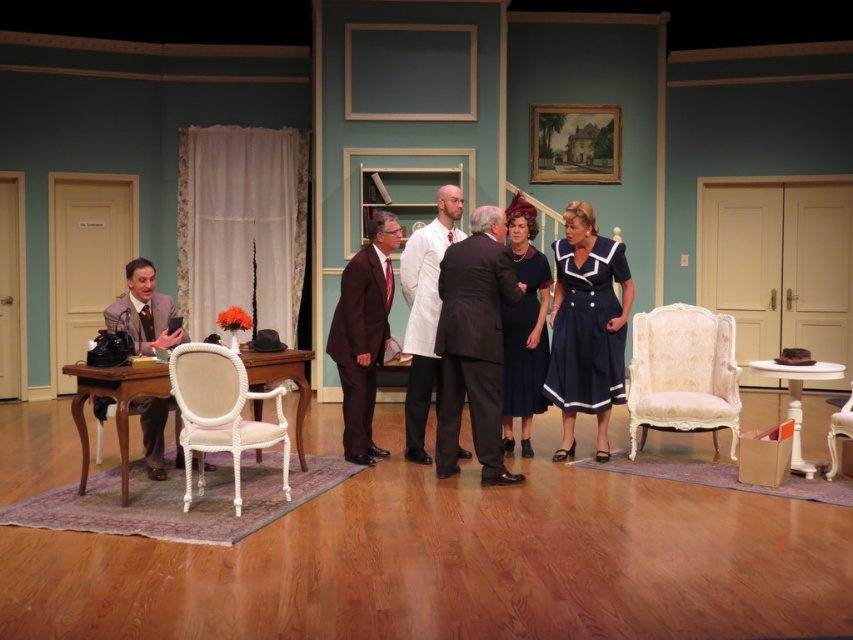
Question: Which point is farther from the camera taking this photo?

Choices:
 (A) (451, 417)
 (B) (410, 300)
 (C) (368, 250)
 (D) (834, 454)

Answer: (B)

Question: Does navy blue fabric dress at center have a smaller size compared to velvet navy dress at center?

Choices:
 (A) yes
 (B) no

Answer: (B)

Question: In this image, where is white rope chair at center located relative to shiny brown suit at center?

Choices:
 (A) left
 (B) right

Answer: (A)

Question: Which of the following is the farthest from the observer?

Choices:
 (A) white upholstered chair at right
 (B) white rope chair at center

Answer: (A)

Question: Is velvet cream chair at right in front of white matte coat at center?

Choices:
 (A) yes
 (B) no

Answer: (A)

Question: Which of these objects is positioned closest to the dark gray suit at center?

Choices:
 (A) white upholstered chair at right
 (B) navy blue fabric dress at center
 (C) shiny brown suit at center

Answer: (C)